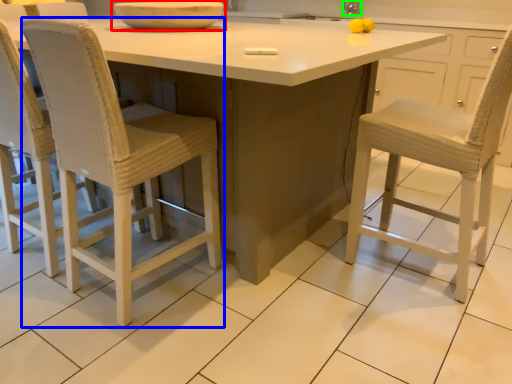
Question: Which object is positioned farthest from bowl (highlighted by a red box)? Select from chair (highlighted by a blue box) and faucet (highlighted by a green box).

Choices:
 (A) chair
 (B) faucet

Answer: (B)